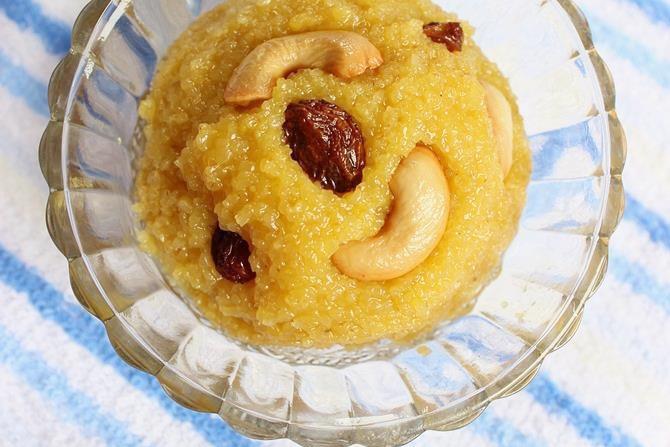
This screenshot has width=670, height=447. Find the location of `empty table place to the upper right of bowl`. empty table place to the upper right of bowl is located at coordinates (628, 12).